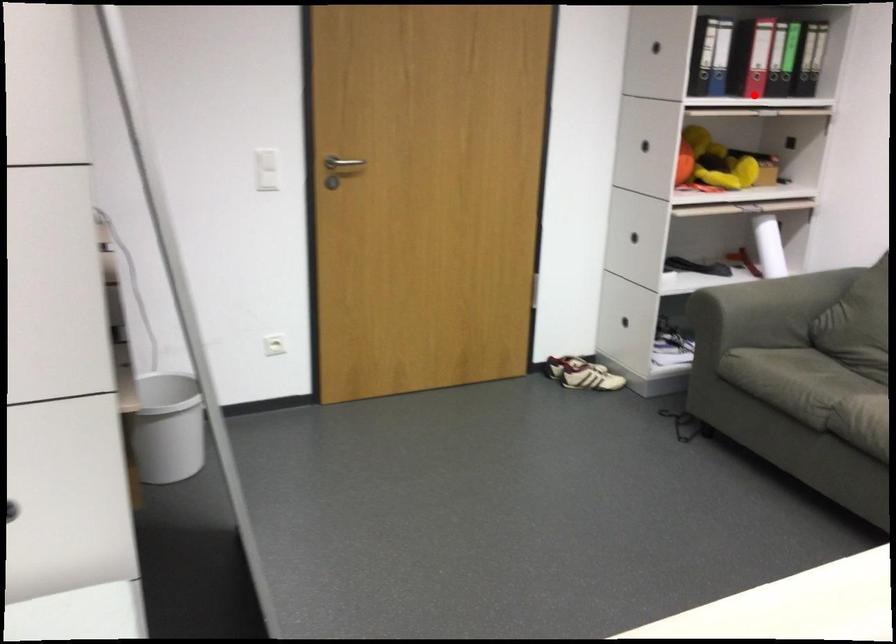
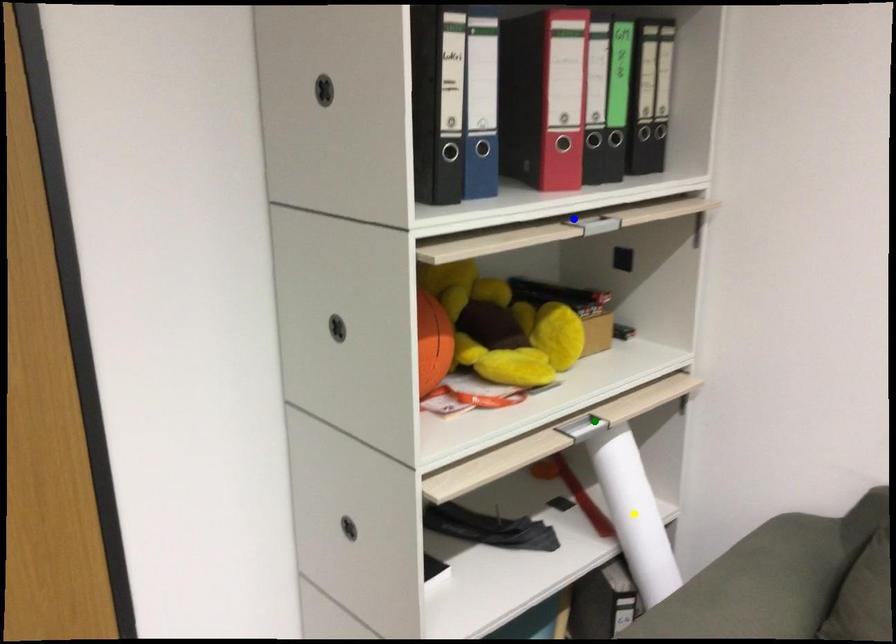
Question: I am providing you with two images of the same scene from different viewpoints. A red point is marked on the first image. You are given multiple points on the second image. Which spot in image 2 lines up with the point in image 1?

Choices:
 (A) green point
 (B) blue point
 (C) yellow point

Answer: (B)